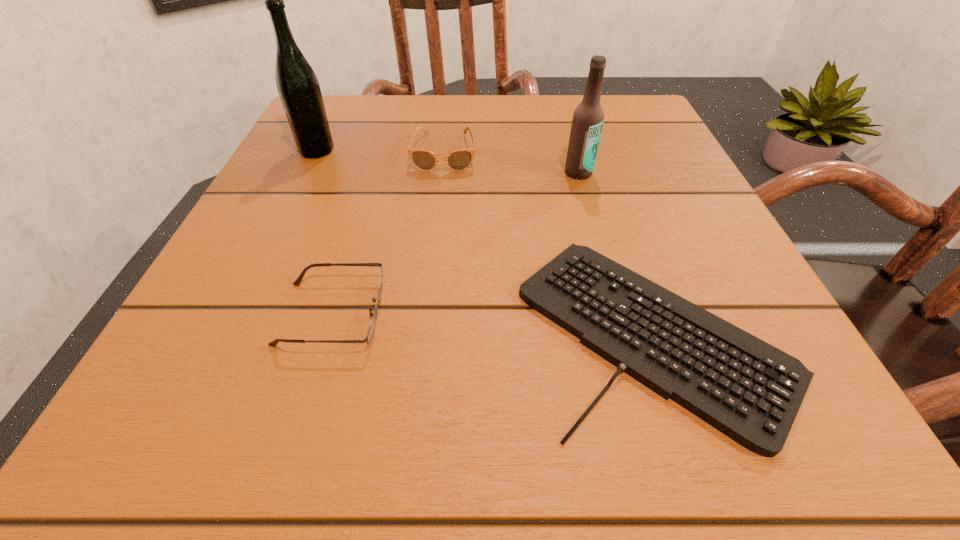
Where is `free location located on the front-facing side of the second shortest object`? free location located on the front-facing side of the second shortest object is located at coordinates (437, 314).

In order to click on vacant space located 0.210m on the back of the computer keyboard in this screenshot , I will do (599, 169).

Locate an element on the screen. This screenshot has height=540, width=960. beer bottle situated at the far edge is located at coordinates (298, 87).

The height and width of the screenshot is (540, 960). I want to click on sunglasses present at the far edge, so click(x=459, y=160).

At what (x,y) coordinates should I click in order to perform the action: click on object that is at the near edge. Please return your answer as a coordinate pair (x, y). The image size is (960, 540). Looking at the image, I should click on [749, 390].

Locate an element on the screen. beer bottle located in the left edge section of the desktop is located at coordinates (298, 87).

Where is `spectacles present at the left edge`? The image size is (960, 540). spectacles present at the left edge is located at coordinates (297, 282).

The height and width of the screenshot is (540, 960). I want to click on object situated at the right edge, so click(749, 390).

The height and width of the screenshot is (540, 960). I want to click on object positioned at the far left corner, so click(298, 87).

Locate an element on the screen. object that is at the near right corner is located at coordinates (749, 390).